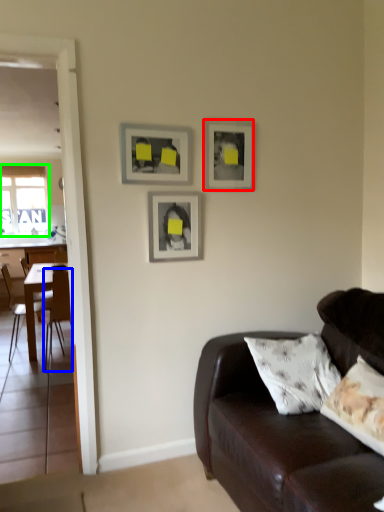
Question: Which object is the farthest from picture frame (highlighted by a red box)? Choose among these: chair (highlighted by a blue box) or window (highlighted by a green box).

Choices:
 (A) chair
 (B) window

Answer: (B)